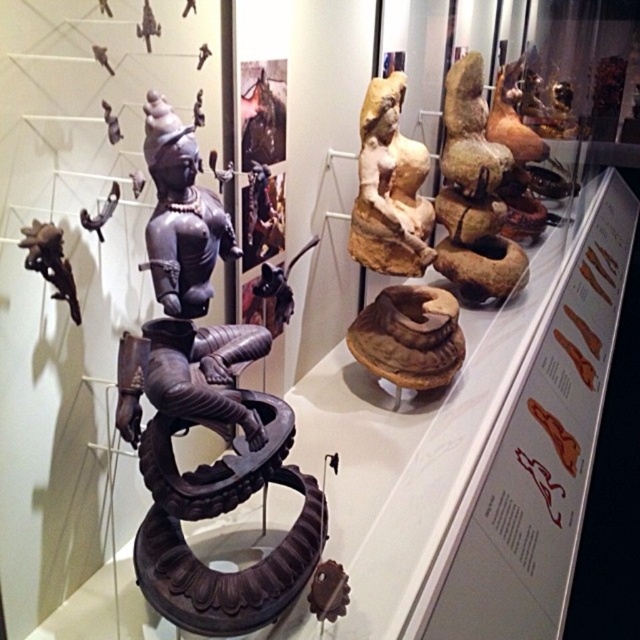
Question: Which point appears closest to the camera in this image?

Choices:
 (A) (384, 224)
 (B) (198, 589)

Answer: (B)

Question: Can you confirm if black polished wood statue at center is positioned below matte beige statue at center?

Choices:
 (A) no
 (B) yes

Answer: (B)

Question: Which of the following is the farthest from the observer?

Choices:
 (A) (412, 186)
 (B) (196, 572)

Answer: (A)

Question: From the image, what is the correct spatial relationship of black polished wood statue at center in relation to matte beige statue at center?

Choices:
 (A) above
 (B) below

Answer: (B)

Question: In this image, where is black polished wood statue at center located relative to matte beige statue at center?

Choices:
 (A) below
 (B) above

Answer: (A)